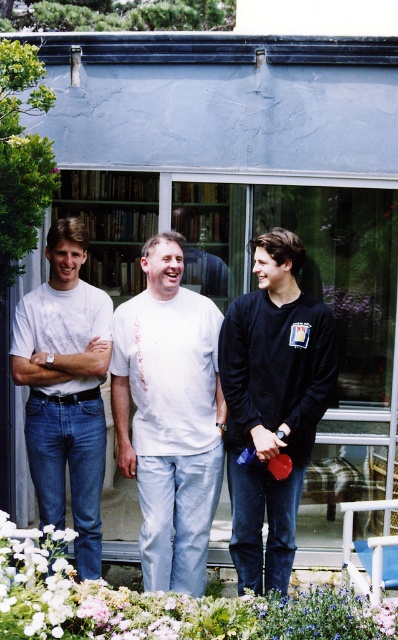
You are taking a photo of the three people in front of the building. You notice two points marked in the image. Which point, point [226,339] or point [306,611], is closer to the camera?

Point [226,339] is further to the camera than point [306,611], so point [226,339] is closer to the camera.